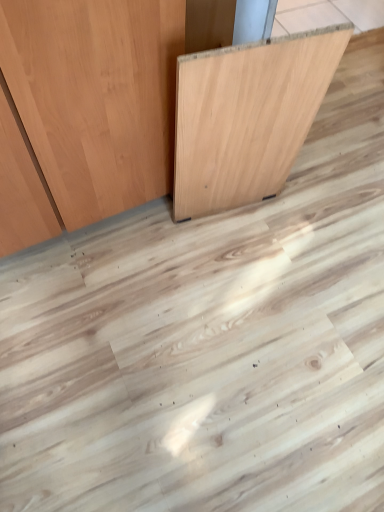
At what (x,y) coordinates should I click in order to perform the action: click on vacant space in front of natural wood board at center. Please return your answer as a coordinate pair (x, y). Image resolution: width=384 pixels, height=512 pixels. Looking at the image, I should click on (203, 278).